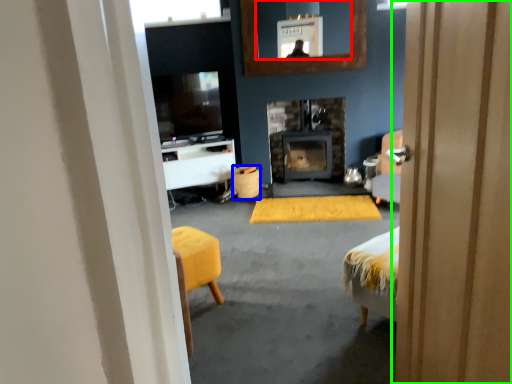
Question: Considering the real-world distances, which object is closest to mirror (highlighted by a red box)? trash bin/can (highlighted by a blue box) or door (highlighted by a green box).

Choices:
 (A) trash bin/can
 (B) door

Answer: (A)